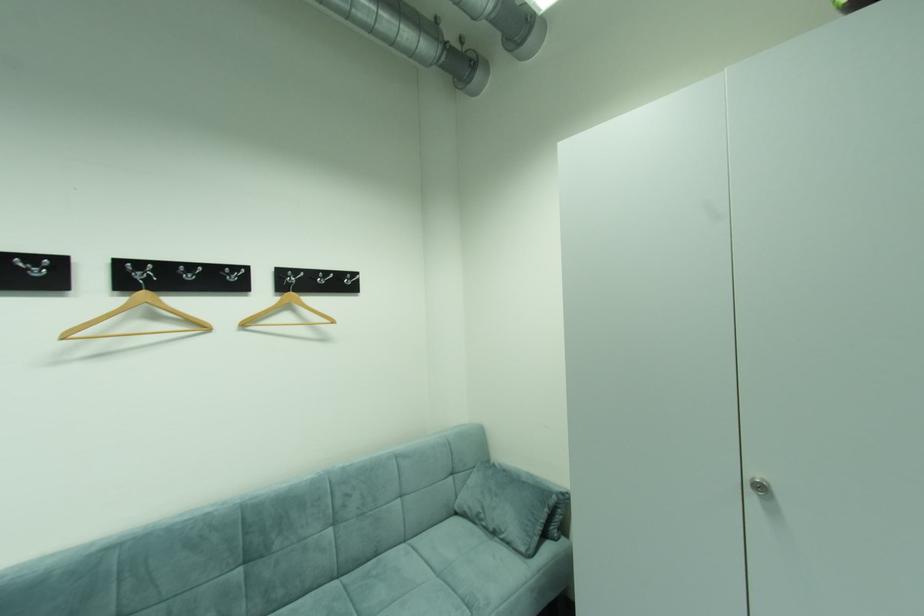
You are a GUI agent. You are given a task and a screenshot of the screen. Output one action in this format:
    pyautogui.click(x=<x>, y=<y>)
    Task: Click on the silver cabinet lock
    The image size is (924, 616).
    Given the screenshot: What is the action you would take?
    pyautogui.click(x=759, y=485)